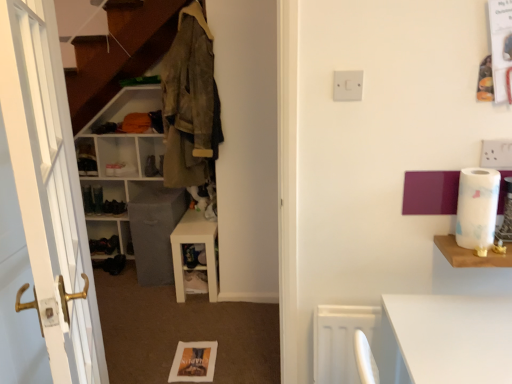
Question: Can you confirm if white wooden door at left is taller than matte white cabinet at left?

Choices:
 (A) yes
 (B) no

Answer: (A)

Question: Is white wooden door at left in contact with matte white cabinet at left?

Choices:
 (A) no
 (B) yes

Answer: (A)

Question: Is matte white cabinet at left completely or partially inside white wooden door at left?

Choices:
 (A) yes
 (B) no

Answer: (B)

Question: Is white wooden door at left aimed at matte white cabinet at left?

Choices:
 (A) no
 (B) yes

Answer: (A)

Question: Is white wooden door at left completely or partially outside of matte white cabinet at left?

Choices:
 (A) no
 (B) yes

Answer: (B)

Question: Is white wooden door at left closer to the viewer compared to matte white cabinet at left?

Choices:
 (A) no
 (B) yes

Answer: (B)

Question: Is camouflage fabric jacket at upper left not close to white matte shelf at center, positioned as the 1th shelf in left-to-right order?

Choices:
 (A) no
 (B) yes

Answer: (A)

Question: Is camouflage fabric jacket at upper left at the right side of white matte shelf at center, marked as the third shelf in a right-to-left arrangement?

Choices:
 (A) no
 (B) yes

Answer: (B)

Question: Can you confirm if camouflage fabric jacket at upper left is wider than white matte shelf at center, marked as the third shelf in a right-to-left arrangement?

Choices:
 (A) no
 (B) yes

Answer: (A)

Question: From a real-world perspective, is camouflage fabric jacket at upper left located beneath white matte shelf at center, positioned as the 1th shelf in left-to-right order?

Choices:
 (A) no
 (B) yes

Answer: (A)

Question: From a real-world perspective, does camouflage fabric jacket at upper left stand above white matte shelf at center, the 3th shelf from the front?

Choices:
 (A) no
 (B) yes

Answer: (B)

Question: Considering the relative sizes of camouflage fabric jacket at upper left and white matte shelf at center, marked as the third shelf in a right-to-left arrangement, in the image provided, is camouflage fabric jacket at upper left smaller than white matte shelf at center, marked as the third shelf in a right-to-left arrangement,?

Choices:
 (A) no
 (B) yes

Answer: (B)

Question: Does white marble toilet paper at right have a lesser width compared to white plastic switch at upper center?

Choices:
 (A) yes
 (B) no

Answer: (B)